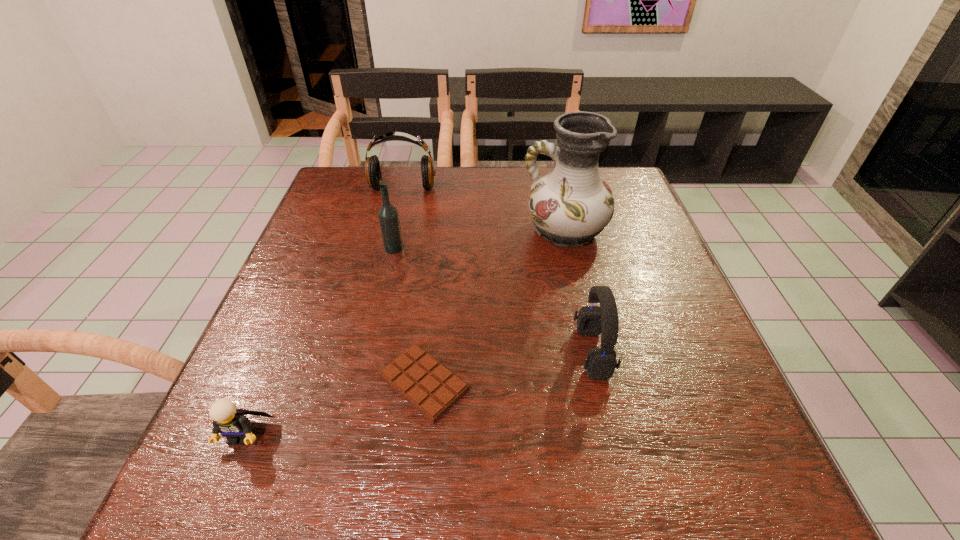
Find the location of a particular element. This screenshot has width=960, height=540. object that is at the right edge is located at coordinates (571, 205).

Image resolution: width=960 pixels, height=540 pixels. I want to click on object that is at the far left corner, so click(372, 166).

At what (x,y) coordinates should I click in order to perform the action: click on object present at the far right corner. Please return your answer as a coordinate pair (x, y). The height and width of the screenshot is (540, 960). Looking at the image, I should click on (571, 205).

Locate an element on the screen. This screenshot has height=540, width=960. vacant space at the near edge is located at coordinates (582, 490).

Find the location of a particular element. Image resolution: width=960 pixels, height=540 pixels. free space at the left edge of the desktop is located at coordinates (284, 408).

Locate an element on the screen. blank area at the right edge is located at coordinates (626, 321).

The width and height of the screenshot is (960, 540). Identify the location of vacant space in between the tallest object and the right headset. (579, 292).

Where is `vacant region between the farthest object and the shortest object`? The height and width of the screenshot is (540, 960). vacant region between the farthest object and the shortest object is located at coordinates (414, 286).

Where is `vacant space in between the vodka and the nearer headset`? Image resolution: width=960 pixels, height=540 pixels. vacant space in between the vodka and the nearer headset is located at coordinates (493, 300).

Identify the location of free spot between the leftmost object and the vodka. The width and height of the screenshot is (960, 540). (319, 341).